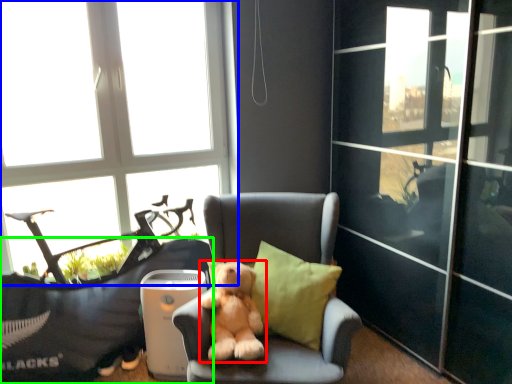
Question: Estimate the real-world distances between objects in this image. Which object is farther from dog (highlighted by a red box), window (highlighted by a blue box) or furniture (highlighted by a green box)?

Choices:
 (A) window
 (B) furniture

Answer: (A)